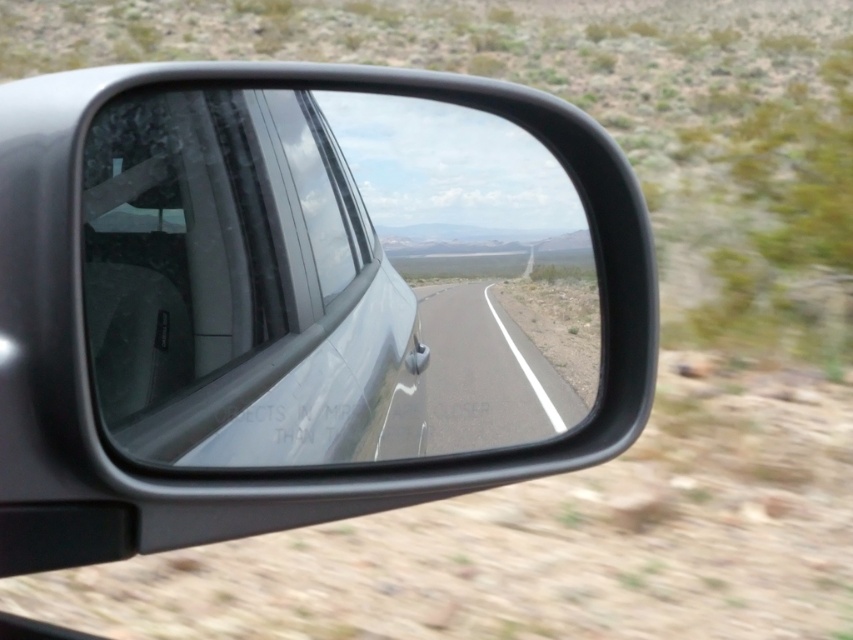
You are a passenger in the car and want to look out the clear glass window at center. Based on the mirror reflection, where should you look relative to the black rectangular mirror?

The clear glass window at center is located at position point (235, 284), so you should look towards the lower right direction from the black rectangular mirror to see it in the reflection.

You are a passenger in the car and looking at the car side mirror. You see two points marked in the image. The first point is at coordinate point [196,172] and the second is at point [552,378]. Which point is closer to you?

Point [196,172] is in front of point [552,378], so it is closer to you.